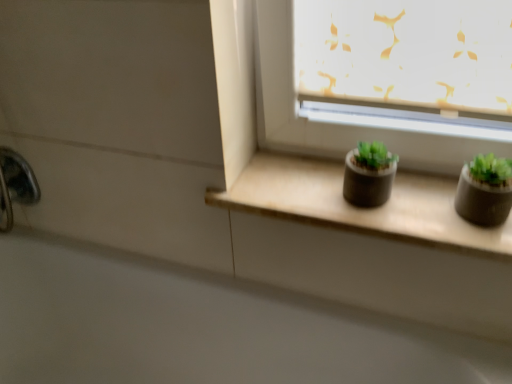
At what (x,y) coordinates should I click in order to perform the action: click on free space on the front side of matte black pot at center, the 1th flowerpot viewed from the left. Please return your answer as a coordinate pair (x, y). This screenshot has width=512, height=384. Looking at the image, I should click on (400, 224).